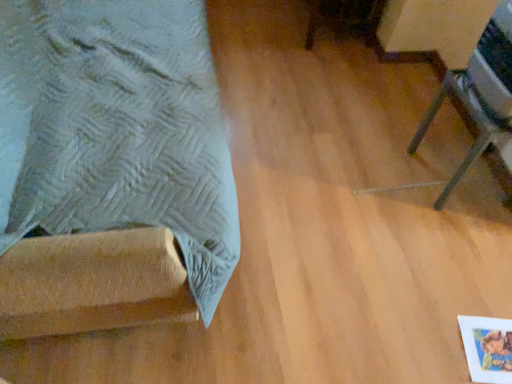
Image resolution: width=512 pixels, height=384 pixels. I want to click on vacant space that is in between metallic silver tripod at right, the second furniture positioned from the left, and suede-like fabric at left, which ranks as the first furniture in left-to-right order, so click(x=314, y=153).